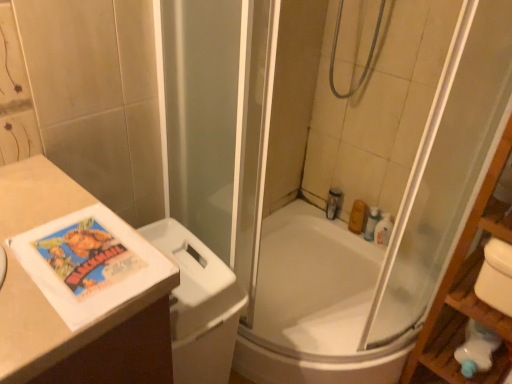
Question: From the image's perspective, is white plastic bottle at upper right, the 2th toiletry when ordered from right to left, located beneath translucent plastic soap at upper right, placed as the fourth toiletry when sorted from left to right?

Choices:
 (A) no
 (B) yes

Answer: (A)

Question: Can you confirm if white plastic bottle at upper right, which is the 3th toiletry from left to right, is positioned to the right of translucent plastic soap at upper right, placed as the 1th toiletry when sorted from right to left?

Choices:
 (A) no
 (B) yes

Answer: (A)

Question: Can you confirm if white plastic bottle at upper right, which is the 3th toiletry from left to right, is positioned to the left of translucent plastic soap at upper right, placed as the 1th toiletry when sorted from right to left?

Choices:
 (A) no
 (B) yes

Answer: (B)

Question: Is white plastic bottle at upper right, the 2th toiletry when ordered from right to left, shorter than translucent plastic soap at upper right, placed as the fourth toiletry when sorted from left to right?

Choices:
 (A) no
 (B) yes

Answer: (A)

Question: Is white plastic bottle at upper right, the 2th toiletry when ordered from right to left, aimed at translucent plastic soap at upper right, placed as the 1th toiletry when sorted from right to left?

Choices:
 (A) yes
 (B) no

Answer: (B)

Question: Is the position of white plastic bottle at upper right, which is the 3th toiletry from left to right, more distant than that of translucent plastic soap at upper right, placed as the fourth toiletry when sorted from left to right?

Choices:
 (A) no
 (B) yes

Answer: (B)

Question: Does orange matte soap at upper right, which appears as the third toiletry when viewed from the right, have a lesser height compared to metallic silver toiletry at upper right, marked as the 4th toiletry in a right-to-left arrangement?

Choices:
 (A) yes
 (B) no

Answer: (A)

Question: Is orange matte soap at upper right, which is counted as the second toiletry, starting from the left, facing towards metallic silver toiletry at upper right, the first toiletry positioned from the left?

Choices:
 (A) no
 (B) yes

Answer: (A)

Question: Is orange matte soap at upper right, which appears as the third toiletry when viewed from the right, wider than metallic silver toiletry at upper right, marked as the 4th toiletry in a right-to-left arrangement?

Choices:
 (A) no
 (B) yes

Answer: (A)

Question: Does orange matte soap at upper right, which appears as the third toiletry when viewed from the right, have a lesser width compared to metallic silver toiletry at upper right, marked as the 4th toiletry in a right-to-left arrangement?

Choices:
 (A) no
 (B) yes

Answer: (B)

Question: Is the position of orange matte soap at upper right, which appears as the third toiletry when viewed from the right, more distant than that of metallic silver toiletry at upper right, marked as the 4th toiletry in a right-to-left arrangement?

Choices:
 (A) yes
 (B) no

Answer: (B)

Question: Is there a large distance between orange matte soap at upper right, which is counted as the second toiletry, starting from the left, and metallic silver toiletry at upper right, marked as the 4th toiletry in a right-to-left arrangement?

Choices:
 (A) yes
 (B) no

Answer: (B)

Question: From a real-world perspective, is white plastic bottle at upper right, the 2th toiletry when ordered from right to left, under wooden shelf at right?

Choices:
 (A) no
 (B) yes

Answer: (B)